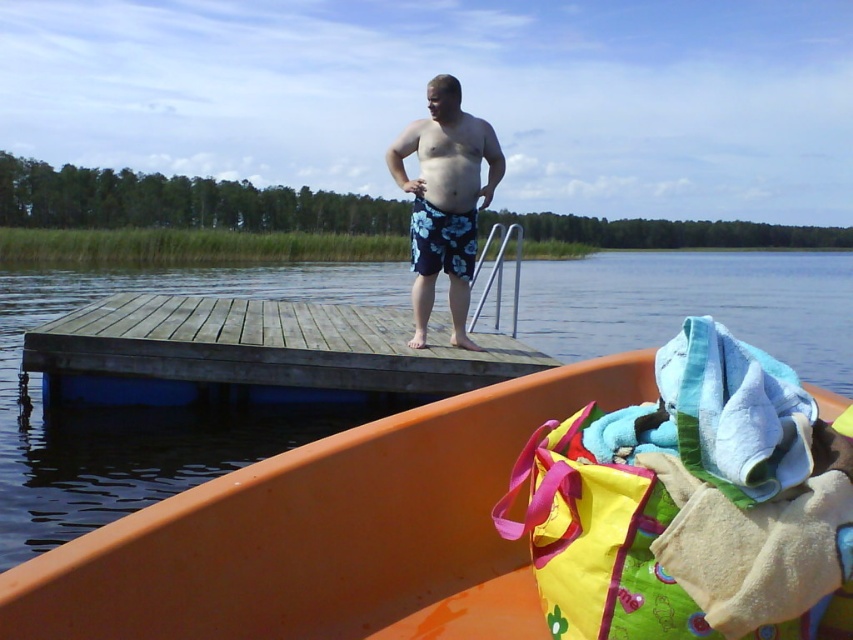
Question: Which is nearer to the orange plastic boat at center?

Choices:
 (A) weathered wood dock at center
 (B) blue floral shorts at center

Answer: (B)

Question: Is orange plastic boat at center smaller than blue floral shorts at center?

Choices:
 (A) yes
 (B) no

Answer: (B)

Question: Which object is closer to the camera taking this photo?

Choices:
 (A) blue floral shorts at center
 (B) weathered wood dock at center
 (C) orange plastic boat at center

Answer: (C)

Question: From the image, what is the correct spatial relationship of orange plastic boat at center in relation to weathered wood dock at center?

Choices:
 (A) below
 (B) above

Answer: (A)

Question: Is weathered wood dock at center to the left of blue floral shorts at center from the viewer's perspective?

Choices:
 (A) no
 (B) yes

Answer: (B)

Question: Which point is farther from the camera taking this photo?

Choices:
 (A) (410, 148)
 (B) (223, 593)

Answer: (A)